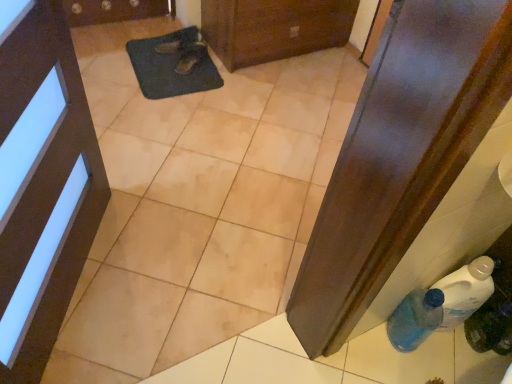
Find the location of a particular element. The width and height of the screenshot is (512, 384). free space between brown wooden door at upper center, which ranks as the 1th door in top-to-bottom order, and blue translucent bottle at lower right, which ranks as the 1th bottle in left-to-right order is located at coordinates (298, 114).